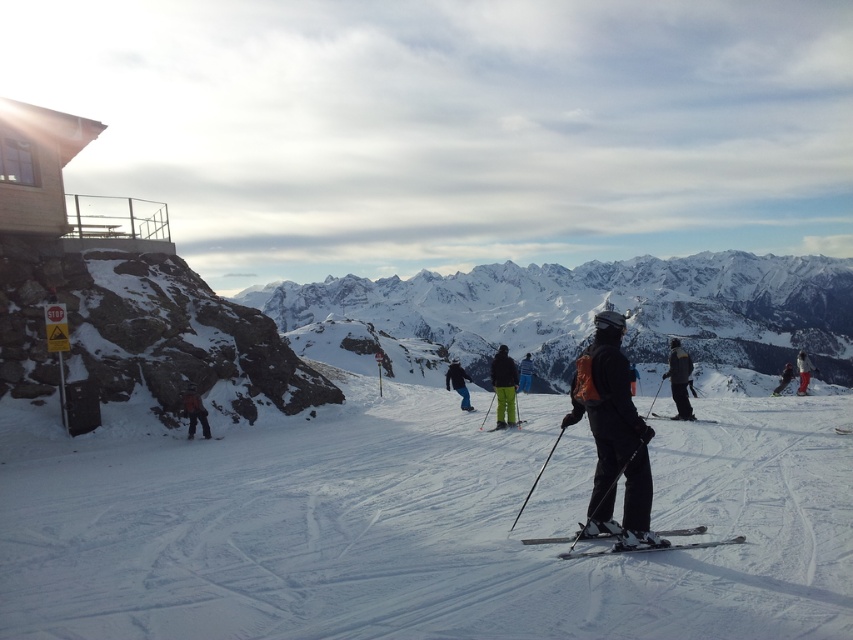
Question: Does white snowboarder at center come in front of orange ski pants at center?

Choices:
 (A) no
 (B) yes

Answer: (B)

Question: Which point appears closest to the camera in this image?

Choices:
 (A) (509, 385)
 (B) (653, 413)
 (C) (498, 428)
 (D) (642, 544)

Answer: (D)

Question: Does black snowboarder at center have a smaller size compared to green matte ski at center?

Choices:
 (A) no
 (B) yes

Answer: (A)

Question: Is shiny black skis at center bigger than green ski pants at center?

Choices:
 (A) yes
 (B) no

Answer: (B)

Question: Which point appears farthest from the camera in this image?

Choices:
 (A) (637, 538)
 (B) (531, 371)
 (C) (193, 385)

Answer: (B)

Question: Which point is farther to the camera?

Choices:
 (A) shiny black skis at center
 (B) white snowboarder at center
 (C) yellow-green ski suit at center-right
 (D) green ski pants at center

Answer: (B)